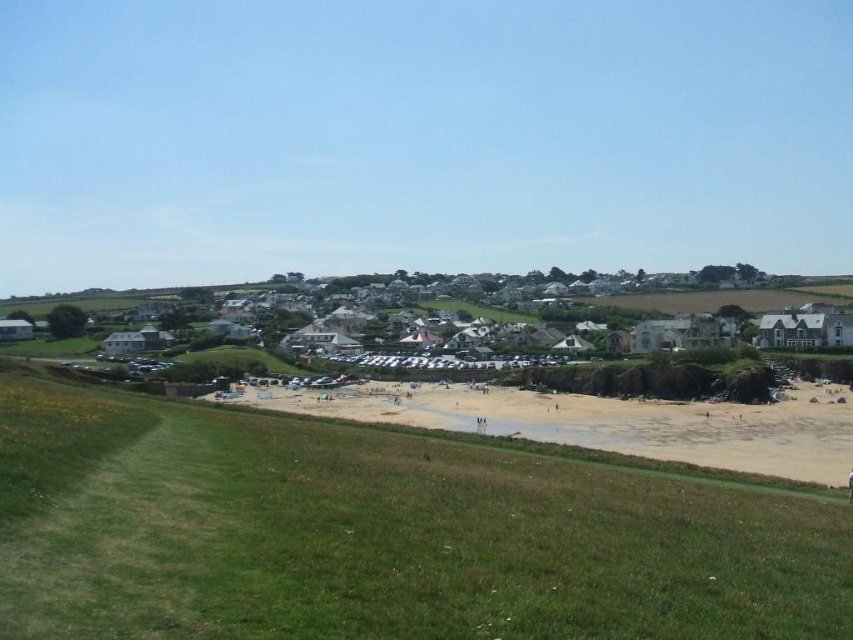
Which is behind, point (672, 620) or point (477, 404)?

Point (477, 404)

Measure the distance between green grassy field at lower center and camera.

green grassy field at lower center and camera are 14.56 meters apart.

This screenshot has height=640, width=853. I want to click on green grassy field at lower center, so click(383, 534).